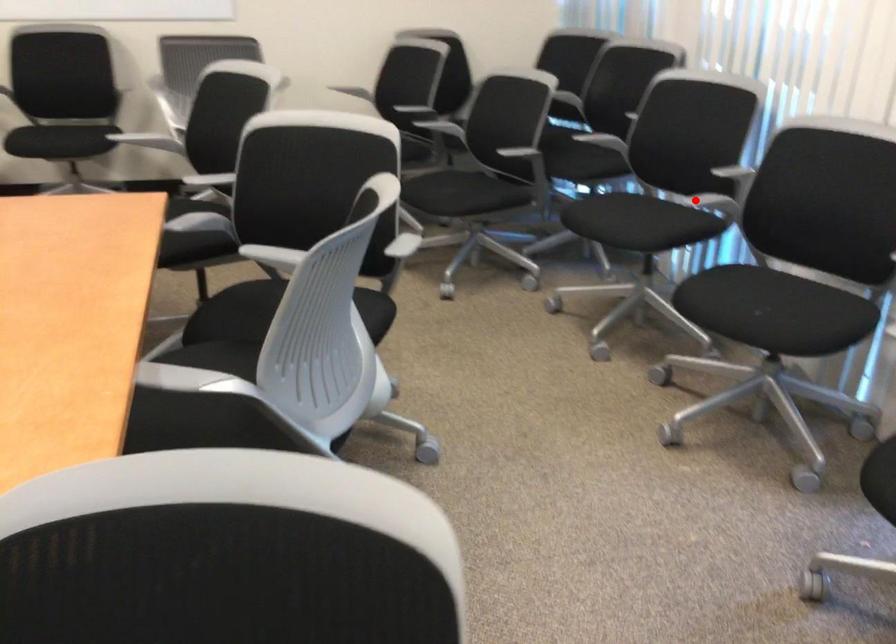
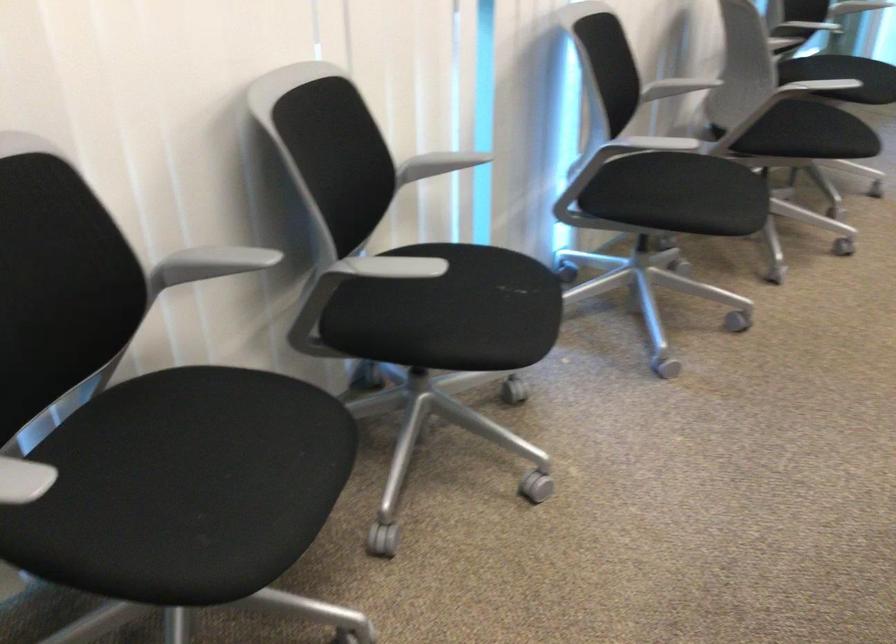
In the second image, find the point that corresponds to the highlighted location in the first image.

(384, 267)